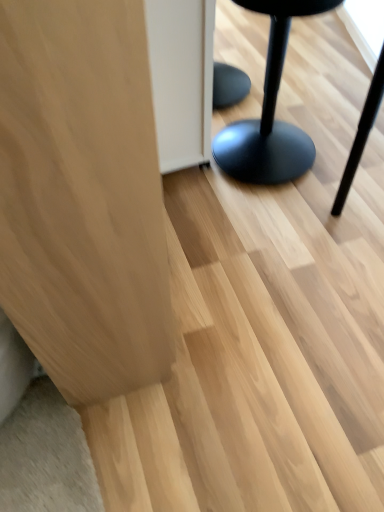
Describe the element at coordinates (270, 110) in the screenshot. The image size is (384, 512). I see `matte black stool at right, the 2th furniture when ordered from left to right` at that location.

What are the coordinates of `matte black stool at right, placed as the first furniture when sorted from right to left` in the screenshot? It's located at (270, 110).

I want to click on light wood cabinet at left, positioned as the second furniture in right-to-left order, so click(x=82, y=196).

What is the approximate height of light wood cabinet at left, the 1th furniture from the left?

light wood cabinet at left, the 1th furniture from the left, is 94.49 centimeters tall.

Describe the element at coordinates (82, 196) in the screenshot. Image resolution: width=384 pixels, height=512 pixels. I see `light wood cabinet at left, positioned as the second furniture in right-to-left order` at that location.

What are the coordinates of `matte black stool at right, placed as the first furniture when sorted from right to left` in the screenshot? It's located at (270, 110).

Would you say light wood cabinet at left, the 1th furniture from the left, is to the left or to the right of matte black stool at right, the 2th furniture when ordered from left to right, in the picture?

In the image, light wood cabinet at left, the 1th furniture from the left, appears on the left side of matte black stool at right, the 2th furniture when ordered from left to right.

Based on the photo, which object is closer to the camera, light wood cabinet at left, positioned as the second furniture in right-to-left order, or matte black stool at right, the 2th furniture when ordered from left to right?

light wood cabinet at left, positioned as the second furniture in right-to-left order, is in front.

Does point (28, 51) appear closer or farther from the camera than point (287, 160)?

Clearly, point (28, 51) is closer to the camera than point (287, 160).

In the scene shown: From the image's perspective, is light wood cabinet at left, the 1th furniture from the left, positioned above or below matte black stool at right, the 2th furniture when ordered from left to right?

light wood cabinet at left, the 1th furniture from the left, is situated lower than matte black stool at right, the 2th furniture when ordered from left to right, in the image.

From a real-world perspective, is light wood cabinet at left, positioned as the second furniture in right-to-left order, positioned above or below matte black stool at right, placed as the first furniture when sorted from right to left?

light wood cabinet at left, positioned as the second furniture in right-to-left order, is above matte black stool at right, placed as the first furniture when sorted from right to left.

Considering the sizes of objects light wood cabinet at left, the 1th furniture from the left, and matte black stool at right, placed as the first furniture when sorted from right to left, in the image provided, who is wider, light wood cabinet at left, the 1th furniture from the left, or matte black stool at right, placed as the first furniture when sorted from right to left,?

light wood cabinet at left, the 1th furniture from the left, is wider.

Is light wood cabinet at left, the 1th furniture from the left, shorter than matte black stool at right, the 2th furniture when ordered from left to right?

In fact, light wood cabinet at left, the 1th furniture from the left, may be taller than matte black stool at right, the 2th furniture when ordered from left to right.

Which of these two, light wood cabinet at left, positioned as the second furniture in right-to-left order, or matte black stool at right, the 2th furniture when ordered from left to right, is bigger?

Bigger between the two is light wood cabinet at left, positioned as the second furniture in right-to-left order.

Would you say light wood cabinet at left, positioned as the second furniture in right-to-left order, is inside or outside matte black stool at right, the 2th furniture when ordered from left to right?

light wood cabinet at left, positioned as the second furniture in right-to-left order, is located beyond the bounds of matte black stool at right, the 2th furniture when ordered from left to right.

Would you say light wood cabinet at left, positioned as the second furniture in right-to-left order, is a long distance from matte black stool at right, placed as the first furniture when sorted from right to left?

Indeed, light wood cabinet at left, positioned as the second furniture in right-to-left order, is not near matte black stool at right, placed as the first furniture when sorted from right to left.

Is light wood cabinet at left, the 1th furniture from the left, turned away from matte black stool at right, the 2th furniture when ordered from left to right?

No.

In order to click on furniture above the light wood cabinet at left, positioned as the second furniture in right-to-left order (from the image's perspective) in this screenshot , I will do `click(270, 110)`.

Does matte black stool at right, placed as the first furniture when sorted from right to left, appear on the right side of light wood cabinet at left, positioned as the second furniture in right-to-left order?

Yes.

In the scene shown: Considering the positions of objects matte black stool at right, the 2th furniture when ordered from left to right, and light wood cabinet at left, positioned as the second furniture in right-to-left order, in the image provided, who is in front, matte black stool at right, the 2th furniture when ordered from left to right, or light wood cabinet at left, positioned as the second furniture in right-to-left order,?

Positioned in front is light wood cabinet at left, positioned as the second furniture in right-to-left order.

Which is in front, point (231, 157) or point (65, 87)?

Positioned in front is point (65, 87).

From the image's perspective, is matte black stool at right, the 2th furniture when ordered from left to right, above or below light wood cabinet at left, the 1th furniture from the left?

From the image's perspective, matte black stool at right, the 2th furniture when ordered from left to right, appears above light wood cabinet at left, the 1th furniture from the left.

From a real-world perspective, is matte black stool at right, the 2th furniture when ordered from left to right, located higher than light wood cabinet at left, positioned as the second furniture in right-to-left order?

No, from a real-world perspective, matte black stool at right, the 2th furniture when ordered from left to right, is not above light wood cabinet at left, positioned as the second furniture in right-to-left order.

Considering the relative sizes of matte black stool at right, the 2th furniture when ordered from left to right, and light wood cabinet at left, positioned as the second furniture in right-to-left order, in the image provided, is matte black stool at right, the 2th furniture when ordered from left to right, wider than light wood cabinet at left, positioned as the second furniture in right-to-left order,?

No.

Does matte black stool at right, placed as the first furniture when sorted from right to left, have a greater height compared to light wood cabinet at left, the 1th furniture from the left?

No.

Considering the sizes of objects matte black stool at right, the 2th furniture when ordered from left to right, and light wood cabinet at left, the 1th furniture from the left, in the image provided, who is smaller, matte black stool at right, the 2th furniture when ordered from left to right, or light wood cabinet at left, the 1th furniture from the left,?

With smaller size is matte black stool at right, the 2th furniture when ordered from left to right.

Looking at this image, is matte black stool at right, the 2th furniture when ordered from left to right, completely or partially outside of light wood cabinet at left, positioned as the second furniture in right-to-left order?

That's correct, matte black stool at right, the 2th furniture when ordered from left to right, is outside of light wood cabinet at left, positioned as the second furniture in right-to-left order.

Is there a large distance between matte black stool at right, the 2th furniture when ordered from left to right, and light wood cabinet at left, the 1th furniture from the left?

Yes, matte black stool at right, the 2th furniture when ordered from left to right, and light wood cabinet at left, the 1th furniture from the left, are located far from each other.

Is matte black stool at right, the 2th furniture when ordered from left to right, facing away from light wood cabinet at left, the 1th furniture from the left?

That's not correct — matte black stool at right, the 2th furniture when ordered from left to right, is not looking away from light wood cabinet at left, the 1th furniture from the left.

Could you measure the distance between matte black stool at right, placed as the first furniture when sorted from right to left, and light wood cabinet at left, the 1th furniture from the left?

matte black stool at right, placed as the first furniture when sorted from right to left, and light wood cabinet at left, the 1th furniture from the left, are 3.32 feet apart from each other.

Where is `furniture that is on the right side of light wood cabinet at left, positioned as the second furniture in right-to-left order`? Image resolution: width=384 pixels, height=512 pixels. furniture that is on the right side of light wood cabinet at left, positioned as the second furniture in right-to-left order is located at coordinates (270, 110).

You are a GUI agent. You are given a task and a screenshot of the screen. Output one action in this format:
    pyautogui.click(x=<x>, y=<y>)
    Task: Click on the furniture below the matte black stool at right, the 2th furniture when ordered from left to right (from the image's perspective)
    This screenshot has height=512, width=384.
    Given the screenshot: What is the action you would take?
    coord(82,196)

Locate an element on the screen. The image size is (384, 512). furniture directly beneath the light wood cabinet at left, positioned as the second furniture in right-to-left order (from a real-world perspective) is located at coordinates (270, 110).